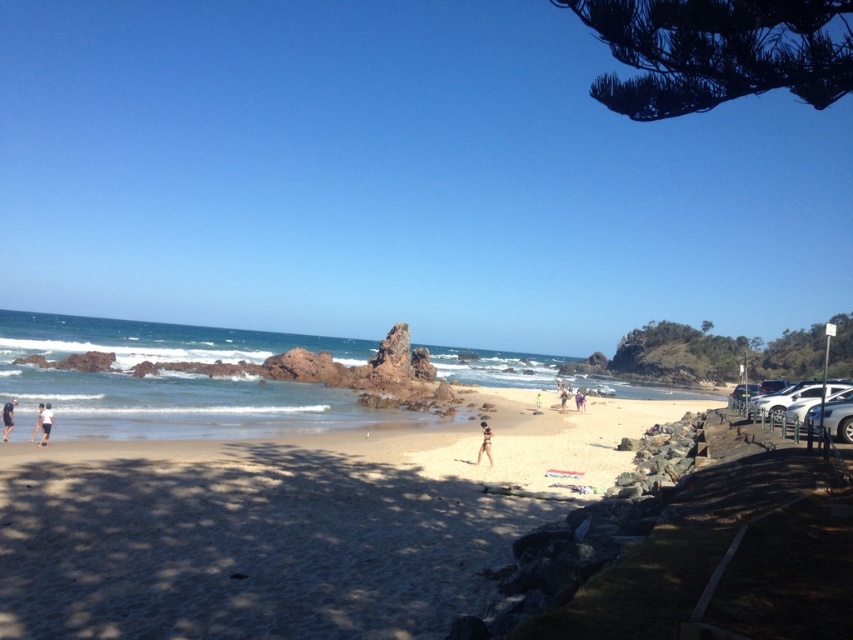
Can you confirm if black fabric person at lower left is positioned to the left of tan skin person at lower left?

No, black fabric person at lower left is not to the left of tan skin person at lower left.

Which is below, black fabric person at lower left or tan skin person at lower left?

tan skin person at lower left is below.

The height and width of the screenshot is (640, 853). I want to click on black fabric person at lower left, so click(x=45, y=422).

Who is lower down, smooth sand beach at center or beige sandy beach at center?

beige sandy beach at center

Measure the distance between smooth sand beach at center and camera.

The distance of smooth sand beach at center from camera is 32.14 feet.

Image resolution: width=853 pixels, height=640 pixels. I want to click on smooth sand beach at center, so click(x=289, y=525).

Can you confirm if black fabric person at lower left is shorter than matte white shorts at lower left?

Yes, black fabric person at lower left is shorter than matte white shorts at lower left.

Is black fabric person at lower left taller than matte white shorts at lower left?

In fact, black fabric person at lower left may be shorter than matte white shorts at lower left.

Is point (44, 429) positioned after point (9, 429)?

No, (44, 429) is closer to viewer.

Locate an element on the screen. Image resolution: width=853 pixels, height=640 pixels. black fabric person at lower left is located at coordinates (45, 422).